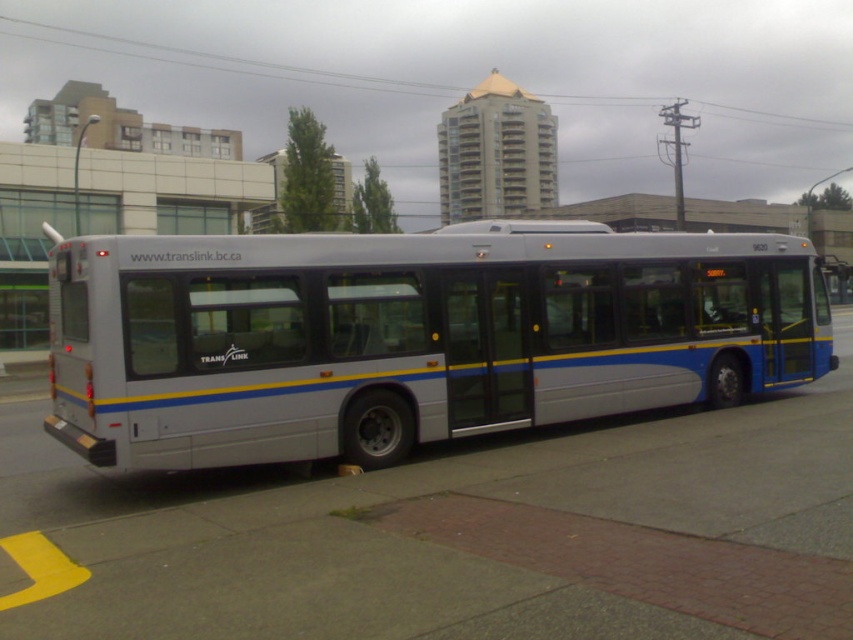
Question: Which point is closer to the camera taking this photo?

Choices:
 (A) (73, 561)
 (B) (584, 346)

Answer: (A)

Question: Is gray concrete pavement at center to the right of silver metallic bus at center from the viewer's perspective?

Choices:
 (A) yes
 (B) no

Answer: (A)

Question: Is gray concrete pavement at center positioned before silver metallic bus at center?

Choices:
 (A) no
 (B) yes

Answer: (B)

Question: Which point is closer to the camera?

Choices:
 (A) (592, 348)
 (B) (618, 612)

Answer: (B)

Question: Does gray concrete pavement at center appear over silver metallic bus at center?

Choices:
 (A) no
 (B) yes

Answer: (A)

Question: Which object is closer to the camera taking this photo?

Choices:
 (A) silver metallic bus at center
 (B) gray concrete pavement at center

Answer: (B)